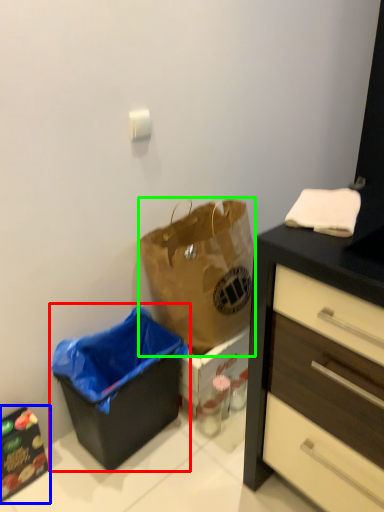
Question: Estimate the real-world distances between objects in this image. Which object is closer to recycling bin (highlighted by a red box), cabinetry (highlighted by a blue box) or handbag (highlighted by a green box)?

Choices:
 (A) cabinetry
 (B) handbag

Answer: (B)